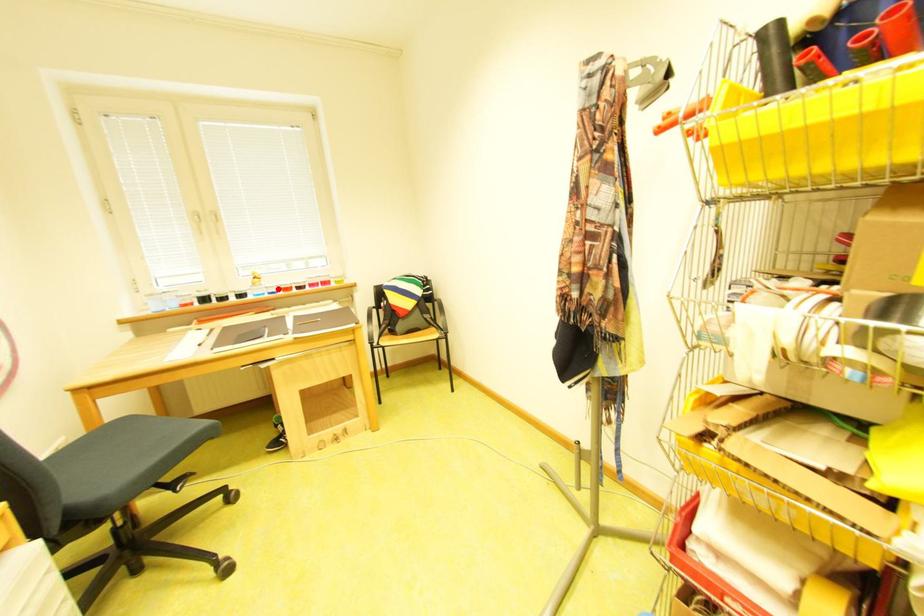
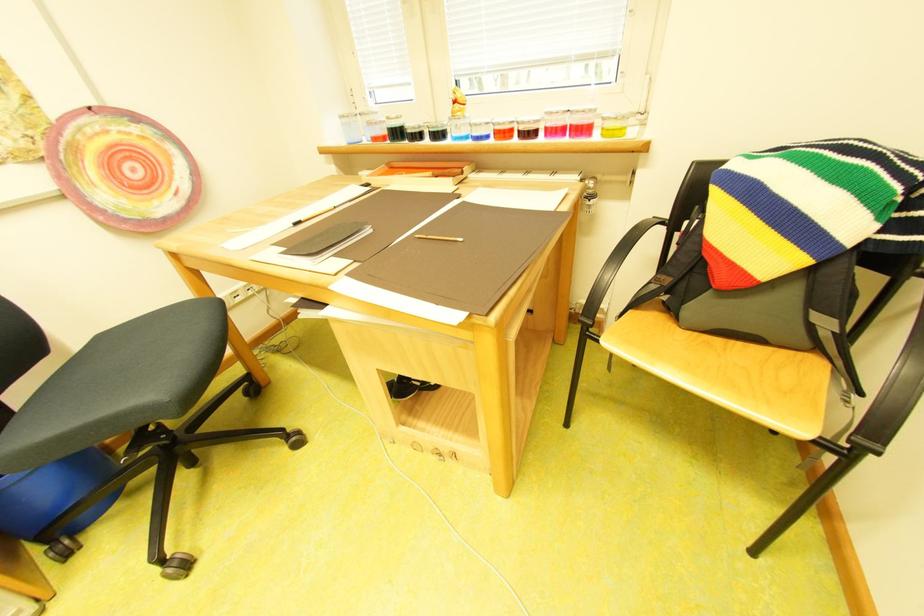
Question: A red point is marked in image1. In image2, is the corresponding 3D point closer to the camera or farther? Reply with the corresponding letter.

Choices:
 (A) The corresponding 3D point is closer.
 (B) The corresponding 3D point is farther.

Answer: (A)